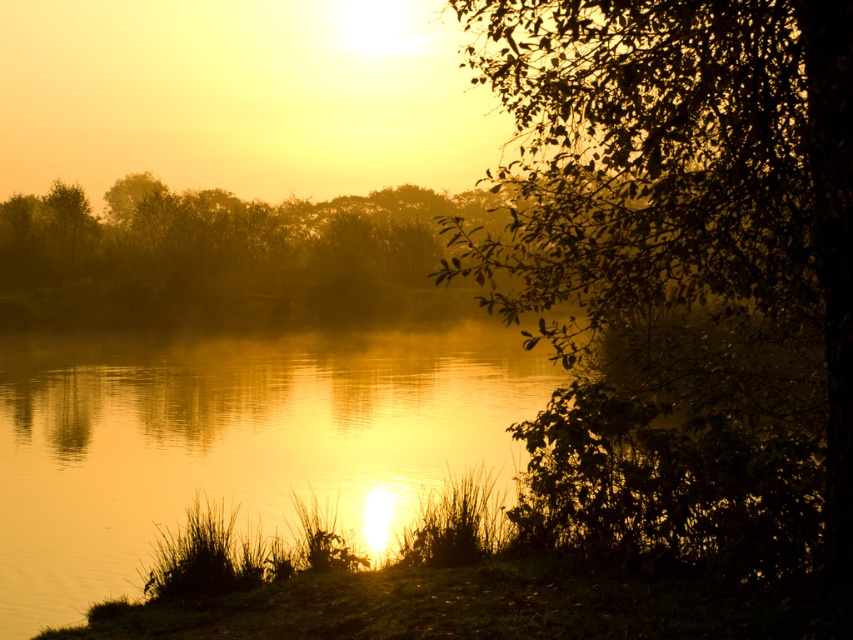
Question: Where is green leafy tree at right located in relation to golden reflective water at center in the image?

Choices:
 (A) left
 (B) right

Answer: (B)

Question: Is green leafy tree at right further to camera compared to golden reflective water at center?

Choices:
 (A) yes
 (B) no

Answer: (B)

Question: Is green leafy tree at right thinner than golden reflective water at center?

Choices:
 (A) no
 (B) yes

Answer: (B)

Question: Which point is farther to the camera?

Choices:
 (A) (788, 352)
 (B) (210, 458)

Answer: (B)